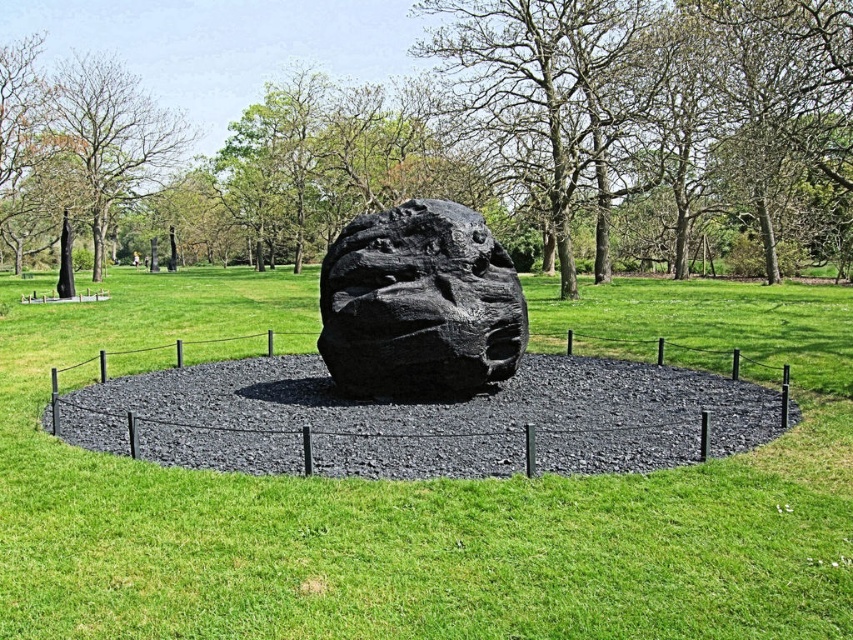
You are standing at the point marked by the coordinates point (447, 129). Looking around, you see a green leafy tree at center. What is the nearest object to you?

The nearest object to you is the green leafy tree at center located at point (447, 129).

You are standing in front of the sculpture and want to determine the position of two points on it. Which point, point (590, 163) or point (402, 321), is closer to you?

Point (590, 163) is closer to you because it is further to the viewer than point (402, 321).